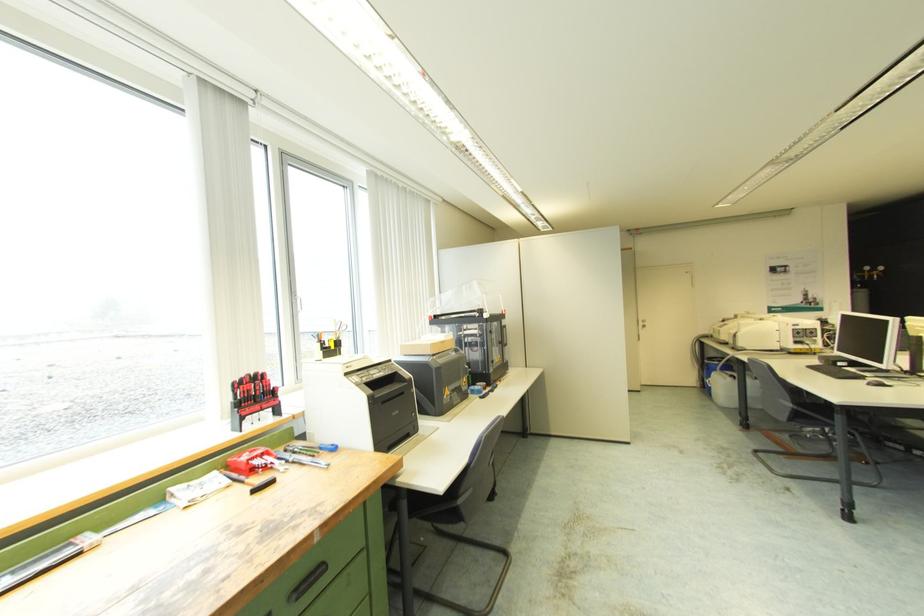
Where is `black chair armrest`? The width and height of the screenshot is (924, 616). black chair armrest is located at coordinates [441, 506].